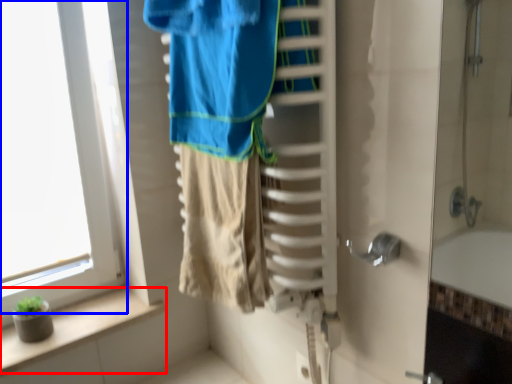
Question: Which of the following is the closest to the observer, balustrade (highlighted by a red box) or window (highlighted by a blue box)?

Choices:
 (A) balustrade
 (B) window

Answer: (B)